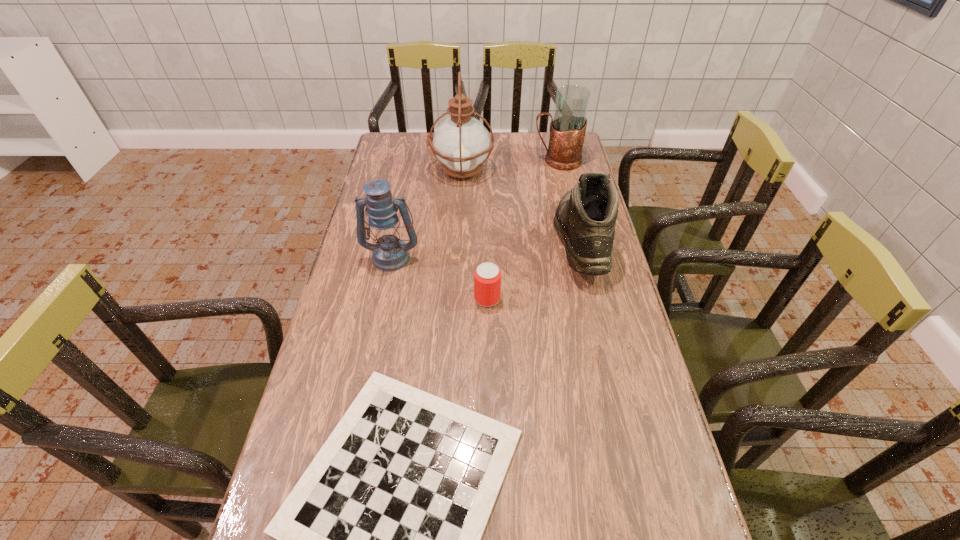
You are a GUI agent. You are given a task and a screenshot of the screen. Output one action in this format:
    pyautogui.click(x=<x>, y=<y>)
    Task: Click on the tallest object
    
    Given the screenshot: What is the action you would take?
    pyautogui.click(x=461, y=143)

I want to click on pitcher, so click(568, 126).

This screenshot has width=960, height=540. What are the coordinates of `lantern` in the screenshot? It's located at (390, 253).

This screenshot has width=960, height=540. Identify the location of ski boot. (585, 217).

You are a GUI agent. You are given a task and a screenshot of the screen. Output one action in this format:
    pyautogui.click(x=<x>, y=<y>)
    Task: Click on the second shortest object
    
    Given the screenshot: What is the action you would take?
    pyautogui.click(x=487, y=277)

Locate an element on the screen. The height and width of the screenshot is (540, 960). vacant space located 0.180m on the front of the oil lamp is located at coordinates (459, 219).

The width and height of the screenshot is (960, 540). I want to click on vacant space situated with the handle on the side of the pitcher, so [x=510, y=160].

The height and width of the screenshot is (540, 960). Find the location of `free region located with the handle on the side of the pitcher`. free region located with the handle on the side of the pitcher is located at coordinates (483, 160).

You are a GUI agent. You are given a task and a screenshot of the screen. Output one action in this format:
    pyautogui.click(x=<x>, y=<y>)
    Task: Click on the free space located with the handle on the side of the pitcher
    The height and width of the screenshot is (540, 960).
    Given the screenshot: What is the action you would take?
    pyautogui.click(x=480, y=160)

I want to click on vacant space located on the front-facing side of the lantern, so click(382, 305).